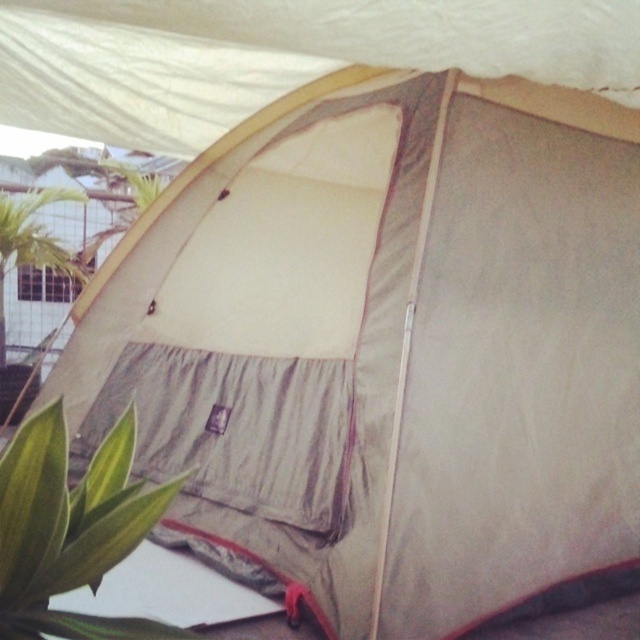
You are setting up a photography backdrop and need to choose between the beige fabric tent at upper center and the green leafy plant at upper left. Since you want the larger object to serve as the main subject, which one should you select?

The beige fabric tent at upper center is larger in size than the green leafy plant at upper left, so you should select the beige fabric tent at upper center as the main subject.

You are a gardener who needs to water two green leafy plants. You have a watering can that can hold enough water for 12 feet of distance. If you start at the green leafy plant at lower left, can you reach the green leafy plant at left without refilling your watering can?

The green leafy plant at lower left is 13.38 feet from the green leafy plant at left. Since the watering can can only hold enough water for 12 feet, you cannot reach the green leafy plant at left without refilling.